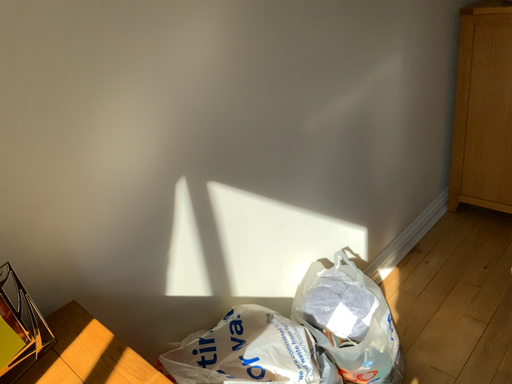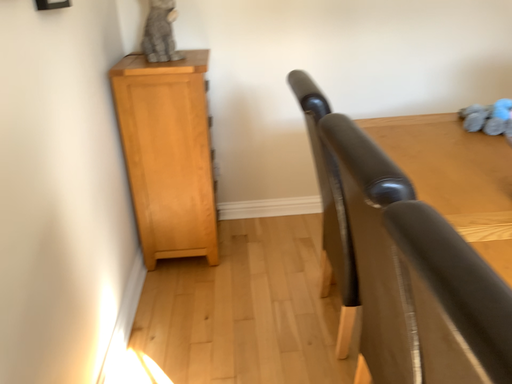
Question: How did the camera likely rotate when shooting the video?

Choices:
 (A) rotated left
 (B) rotated right

Answer: (B)